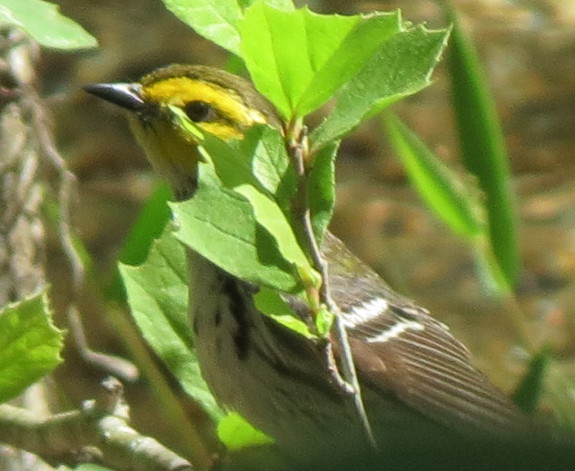
Locate an element on the screen. The width and height of the screenshot is (575, 471). white chest is located at coordinates (233, 368).